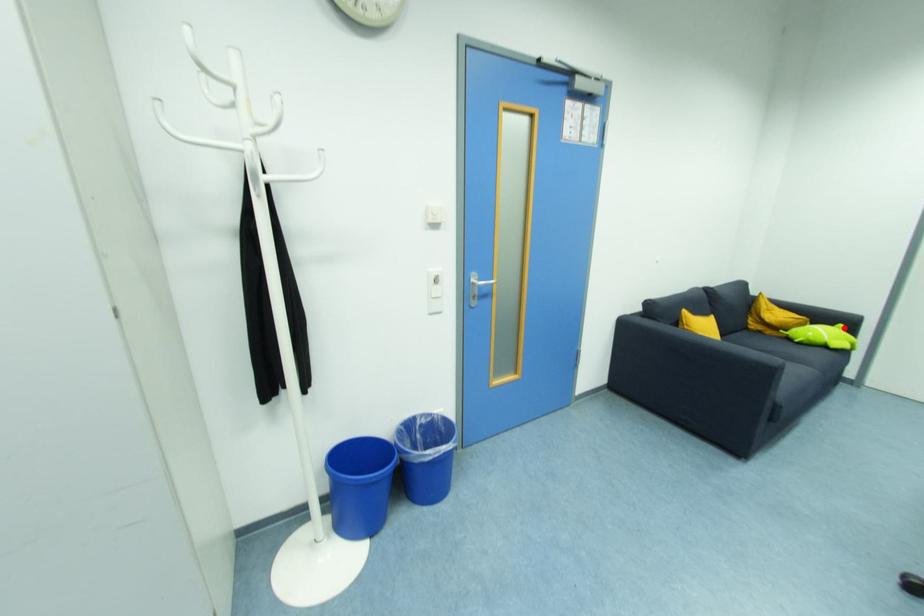
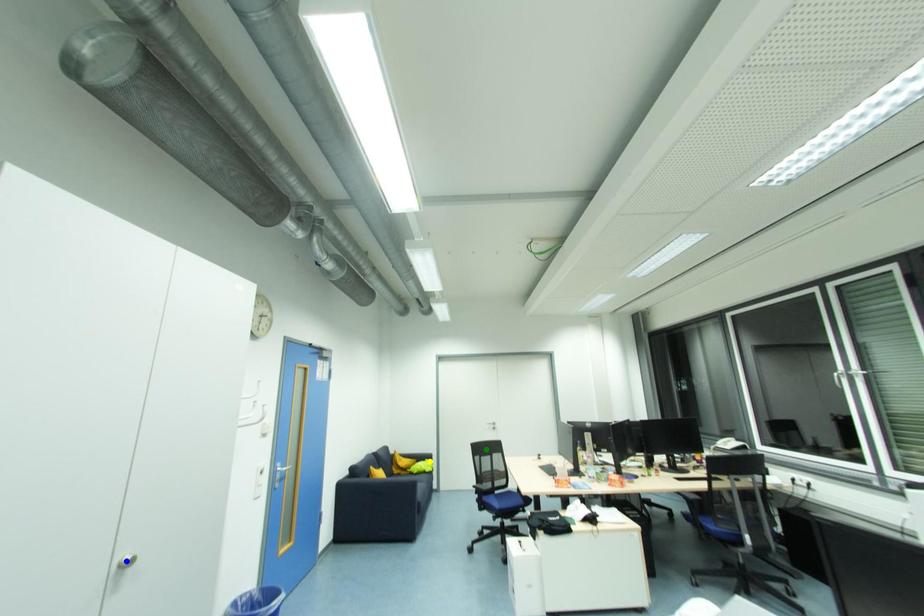
Question: I am providing you with two images of the same scene from different viewpoints. A red point is marked on the first image. You are given multiple points on the second image. Which mark in image 2 goes with the point in image 1?

Choices:
 (A) green point
 (B) yellow point
 (C) blue point

Answer: (B)